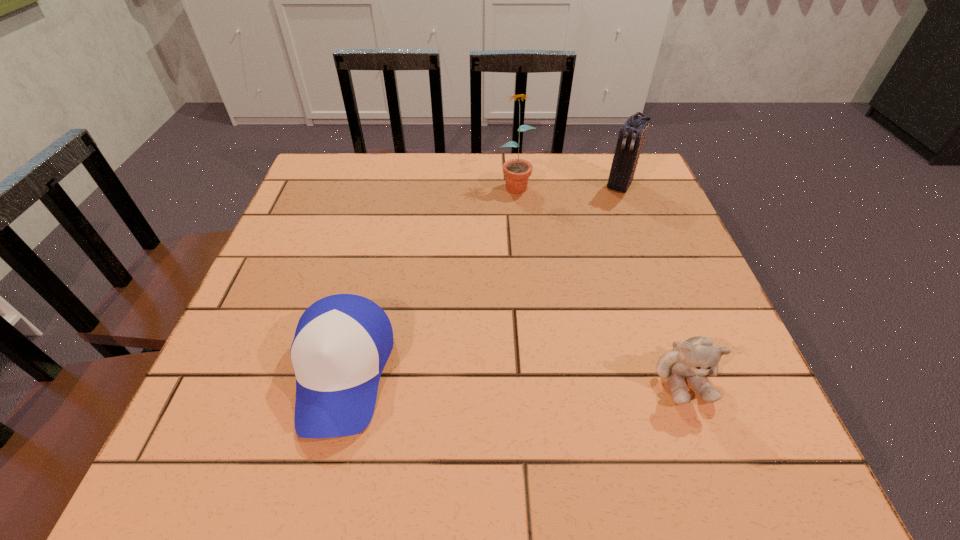
Identify the location of vacant space on the desktop that is between the leftmost object and the teddy bear and is positioned on the flower of the sunflower. Image resolution: width=960 pixels, height=540 pixels. (552, 376).

In order to click on free space on the desktop that is between the leftmost object and the teddy bear and is positioned with the zip open on the clutch bag in this screenshot , I will do `click(489, 375)`.